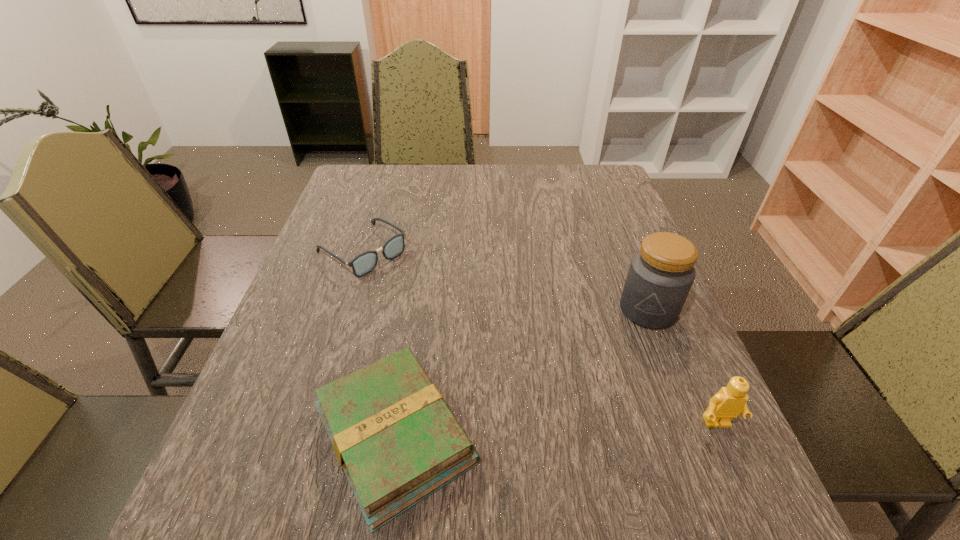
Image resolution: width=960 pixels, height=540 pixels. In order to click on vacant space at the far edge of the desktop in this screenshot , I will do `click(432, 197)`.

I want to click on vacant area at the near edge, so click(322, 458).

This screenshot has width=960, height=540. Identify the location of vacant region at the left edge of the desktop. (304, 315).

You are a GUI agent. You are given a task and a screenshot of the screen. Output one action in this format:
    pyautogui.click(x=<x>, y=<y>)
    Task: Click on the free space at the right edge of the desktop
    The height and width of the screenshot is (540, 960).
    Given the screenshot: What is the action you would take?
    pyautogui.click(x=612, y=211)

Identify the location of free region at the near right corner of the desktop. (637, 424).

Where is `empty space that is in between the jar and the Lego`? Image resolution: width=960 pixels, height=540 pixels. empty space that is in between the jar and the Lego is located at coordinates (683, 367).

The height and width of the screenshot is (540, 960). Find the location of `vacant point located between the third shortest object and the spectacles`. vacant point located between the third shortest object and the spectacles is located at coordinates (540, 337).

Where is `free spot between the book and the tallest object`? This screenshot has width=960, height=540. free spot between the book and the tallest object is located at coordinates (521, 373).

Image resolution: width=960 pixels, height=540 pixels. Find the location of `free spot between the third shortest object and the spectacles`. free spot between the third shortest object and the spectacles is located at coordinates (540, 337).

This screenshot has width=960, height=540. I want to click on free space between the book and the jar, so click(521, 373).